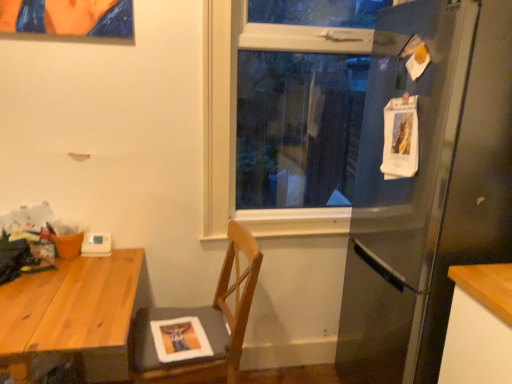
Question: Is white plastic thermostat at upper left taller than wooden desk at left?

Choices:
 (A) no
 (B) yes

Answer: (A)

Question: Is there a large distance between white plastic thermostat at upper left and wooden desk at left?

Choices:
 (A) yes
 (B) no

Answer: (B)

Question: Does white plastic thermostat at upper left appear on the left side of wooden desk at left?

Choices:
 (A) no
 (B) yes

Answer: (A)

Question: From a real-world perspective, is white plastic thermostat at upper left over wooden desk at left?

Choices:
 (A) no
 (B) yes

Answer: (B)

Question: Can you confirm if white plastic thermostat at upper left is thinner than wooden desk at left?

Choices:
 (A) no
 (B) yes

Answer: (B)

Question: Considering the relative positions of wooden chair at center and wooden desk at left in the image provided, is wooden chair at center to the left or to the right of wooden desk at left?

Choices:
 (A) left
 (B) right

Answer: (B)

Question: From a real-world perspective, is wooden chair at center physically located above or below wooden desk at left?

Choices:
 (A) above
 (B) below

Answer: (A)

Question: In the image, is wooden chair at center positioned in front of or behind wooden desk at left?

Choices:
 (A) front
 (B) behind

Answer: (B)

Question: Is point (136, 367) closer or farther from the camera than point (138, 253)?

Choices:
 (A) farther
 (B) closer

Answer: (B)

Question: In terms of height, does satin silver refrigerator at right look taller or shorter compared to clear glass window at center?

Choices:
 (A) short
 (B) tall

Answer: (B)

Question: Would you say satin silver refrigerator at right is to the left or to the right of clear glass window at center in the picture?

Choices:
 (A) right
 (B) left

Answer: (A)

Question: Considering their positions, is satin silver refrigerator at right located in front of or behind clear glass window at center?

Choices:
 (A) front
 (B) behind

Answer: (A)

Question: Choose the correct answer: Is satin silver refrigerator at right inside clear glass window at center or outside it?

Choices:
 (A) inside
 (B) outside

Answer: (B)

Question: Visually, is wooden chair at center positioned to the left or to the right of clear glass window at center?

Choices:
 (A) left
 (B) right

Answer: (A)

Question: Is point (217, 365) closer or farther from the camera than point (309, 36)?

Choices:
 (A) farther
 (B) closer

Answer: (A)